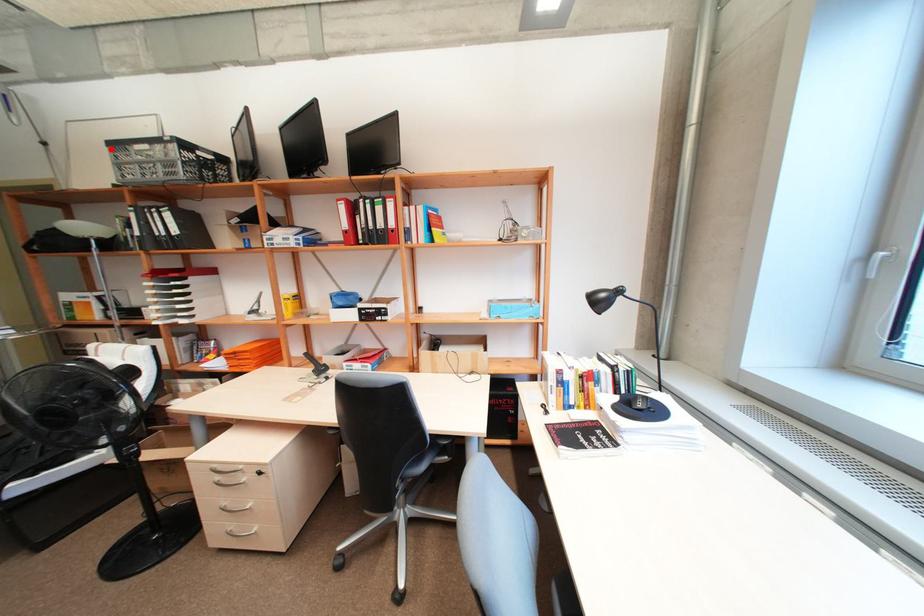
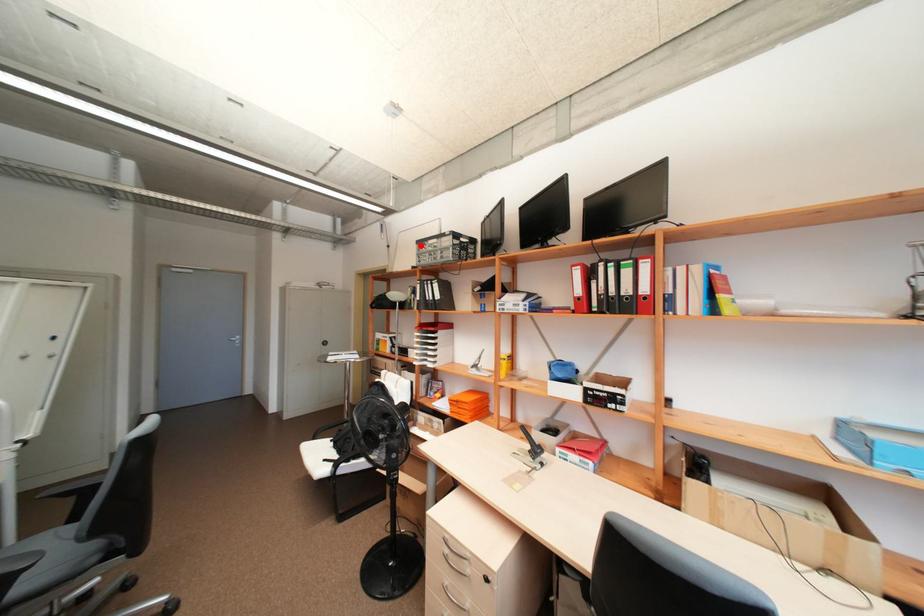
I am providing you with two images of the same scene from different viewpoints. A red point is marked on the first image and another point is marked on the second image. Is the red point in image1 aligned with the point shown in image2?

Yes